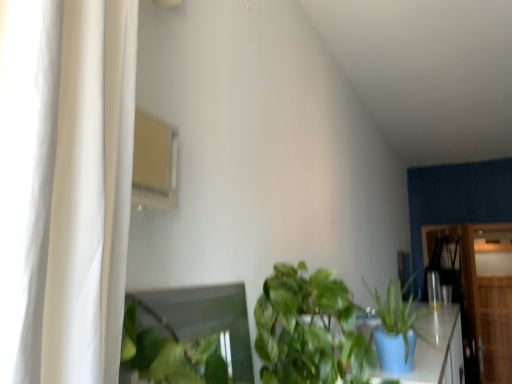
Locate an element on the screen. The image size is (512, 384). wooden dresser at right, which is the first dresser from right to left is located at coordinates (489, 297).

Measure the distance between point (337,309) and camera.

The depth of point (337,309) is 1.11 meters.

The width and height of the screenshot is (512, 384). What do you see at coordinates (309, 330) in the screenshot?
I see `green leafy plant at center, marked as the first houseplant in a left-to-right arrangement` at bounding box center [309, 330].

The height and width of the screenshot is (384, 512). What do you see at coordinates (482, 293) in the screenshot?
I see `wooden dresser at right, which is counted as the 1th dresser, starting from the left` at bounding box center [482, 293].

Where is `wooden dresser at right, which is the first dresser from right to left`? This screenshot has height=384, width=512. wooden dresser at right, which is the first dresser from right to left is located at coordinates (489, 297).

Between matte blue pot at lower right, the second houseplant when ordered from left to right, and green leafy plant at center, marked as the first houseplant in a left-to-right arrangement, which one appears on the left side from the viewer's perspective?

green leafy plant at center, marked as the first houseplant in a left-to-right arrangement.

Is the position of matte blue pot at lower right, the 1th houseplant from the right, more distant than that of green leafy plant at center, placed as the second houseplant when sorted from right to left?

Yes.

Considering the positions of point (408, 301) and point (332, 295), is point (408, 301) closer or farther from the camera than point (332, 295)?

Point (408, 301) is farther from the camera than point (332, 295).

The height and width of the screenshot is (384, 512). In order to click on dresser below the wooden dresser at right, the second dresser from the back (from a real-world perspective) in this screenshot , I will do `click(489, 297)`.

Could you tell me if wooden dresser at right, positioned as the 2th dresser in left-to-right order, is facing wooden dresser at right, which is counted as the 1th dresser, starting from the left?

Yes.

How many degrees apart are the facing directions of wooden dresser at right, which is the first dresser from right to left, and wooden dresser at right, the 1th dresser from the front?

There is a 7.76-degree angle between the facing directions of wooden dresser at right, which is the first dresser from right to left, and wooden dresser at right, the 1th dresser from the front.

From a real-world perspective, is wooden dresser at right, positioned as the 2th dresser in left-to-right order, above or below wooden dresser at right, which is counted as the 1th dresser, starting from the left?

From a real-world perspective, wooden dresser at right, positioned as the 2th dresser in left-to-right order, is physically below wooden dresser at right, which is counted as the 1th dresser, starting from the left.

Is wooden dresser at right, the 1th dresser from the front, oriented away from green leafy plant at center, marked as the first houseplant in a left-to-right arrangement?

wooden dresser at right, the 1th dresser from the front, is not turned away from green leafy plant at center, marked as the first houseplant in a left-to-right arrangement.

Between wooden dresser at right, which is counted as the 1th dresser, starting from the left, and green leafy plant at center, placed as the second houseplant when sorted from right to left, which one appears on the left side from the viewer's perspective?

green leafy plant at center, placed as the second houseplant when sorted from right to left, is more to the left.

Considering the sizes of wooden dresser at right, the 1th dresser from the front, and green leafy plant at center, placed as the second houseplant when sorted from right to left, in the image, is wooden dresser at right, the 1th dresser from the front, taller or shorter than green leafy plant at center, placed as the second houseplant when sorted from right to left,?

wooden dresser at right, the 1th dresser from the front, is taller than green leafy plant at center, placed as the second houseplant when sorted from right to left.

Is point (494, 254) positioned in front of point (343, 340)?

No, it is behind (343, 340).

From a real-world perspective, is wooden dresser at right, marked as the first dresser in a back-to-front arrangement, physically above green leafy plant at center, marked as the first houseplant in a left-to-right arrangement?

No, from a real-world perspective, wooden dresser at right, marked as the first dresser in a back-to-front arrangement, is not above green leafy plant at center, marked as the first houseplant in a left-to-right arrangement.

Could you tell me if wooden dresser at right, placed as the second dresser when sorted from front to back, is facing green leafy plant at center, placed as the second houseplant when sorted from right to left?

Yes, wooden dresser at right, placed as the second dresser when sorted from front to back, is oriented towards green leafy plant at center, placed as the second houseplant when sorted from right to left.

How much distance is there between wooden dresser at right, placed as the second dresser when sorted from front to back, and green leafy plant at center, placed as the second houseplant when sorted from right to left?

wooden dresser at right, placed as the second dresser when sorted from front to back, and green leafy plant at center, placed as the second houseplant when sorted from right to left, are 8.10 feet apart.

From the image's perspective, which is above, green leafy plant at center, placed as the second houseplant when sorted from right to left, or wooden dresser at right, marked as the first dresser in a back-to-front arrangement?

From the image's view, green leafy plant at center, placed as the second houseplant when sorted from right to left, is above.

Considering the relative sizes of green leafy plant at center, marked as the first houseplant in a left-to-right arrangement, and wooden dresser at right, marked as the first dresser in a back-to-front arrangement, in the image provided, is green leafy plant at center, marked as the first houseplant in a left-to-right arrangement, shorter than wooden dresser at right, marked as the first dresser in a back-to-front arrangement,?

Yes.

From a real-world perspective, is green leafy plant at center, placed as the second houseplant when sorted from right to left, positioned over wooden dresser at right, marked as the first dresser in a back-to-front arrangement, based on gravity?

Correct, in the physical world, green leafy plant at center, placed as the second houseplant when sorted from right to left, is higher than wooden dresser at right, marked as the first dresser in a back-to-front arrangement.

What's the angular difference between green leafy plant at center, marked as the first houseplant in a left-to-right arrangement, and wooden dresser at right, positioned as the 2th dresser in left-to-right order,'s facing directions?

The angle between the facing direction of green leafy plant at center, marked as the first houseplant in a left-to-right arrangement, and the facing direction of wooden dresser at right, positioned as the 2th dresser in left-to-right order, is 98.8 degrees.

Considering the relative sizes of green leafy plant at center, marked as the first houseplant in a left-to-right arrangement, and matte blue pot at lower right, the second houseplant when ordered from left to right, in the image provided, is green leafy plant at center, marked as the first houseplant in a left-to-right arrangement, smaller than matte blue pot at lower right, the second houseplant when ordered from left to right,?

Incorrect, green leafy plant at center, marked as the first houseplant in a left-to-right arrangement, is not smaller in size than matte blue pot at lower right, the second houseplant when ordered from left to right.

Looking at this image, is matte blue pot at lower right, the second houseplant when ordered from left to right, completely or partially inside green leafy plant at center, placed as the second houseplant when sorted from right to left?

Yes, matte blue pot at lower right, the second houseplant when ordered from left to right, can be found within green leafy plant at center, placed as the second houseplant when sorted from right to left.

From a real-world perspective, who is located lower, green leafy plant at center, placed as the second houseplant when sorted from right to left, or matte blue pot at lower right, the second houseplant when ordered from left to right?

matte blue pot at lower right, the second houseplant when ordered from left to right, is physically lower.

Could you tell me if green leafy plant at center, marked as the first houseplant in a left-to-right arrangement, is facing matte blue pot at lower right, the 1th houseplant from the right?

Yes, green leafy plant at center, marked as the first houseplant in a left-to-right arrangement, is facing matte blue pot at lower right, the 1th houseplant from the right.

Which object is further away from the camera, matte blue pot at lower right, the 1th houseplant from the right, or wooden dresser at right, positioned as the 2th dresser in left-to-right order?

wooden dresser at right, positioned as the 2th dresser in left-to-right order, is more distant.

From a real-world perspective, is matte blue pot at lower right, the second houseplant when ordered from left to right, positioned under wooden dresser at right, placed as the second dresser when sorted from front to back, based on gravity?

No, from a real-world perspective, matte blue pot at lower right, the second houseplant when ordered from left to right, is not under wooden dresser at right, placed as the second dresser when sorted from front to back.

Looking at this image, is matte blue pot at lower right, the second houseplant when ordered from left to right, bigger than wooden dresser at right, marked as the first dresser in a back-to-front arrangement?

Actually, matte blue pot at lower right, the second houseplant when ordered from left to right, might be smaller than wooden dresser at right, marked as the first dresser in a back-to-front arrangement.

From the image's perspective, would you say matte blue pot at lower right, the 1th houseplant from the right, is positioned over wooden dresser at right, placed as the second dresser when sorted from front to back?

Yes, from the image's perspective, matte blue pot at lower right, the 1th houseplant from the right, is over wooden dresser at right, placed as the second dresser when sorted from front to back.

You are a GUI agent. You are given a task and a screenshot of the screen. Output one action in this format:
    pyautogui.click(x=<x>, y=<y>)
    Task: Click on the houseplant lying below the green leafy plant at center, placed as the second houseplant when sorted from right to left (from the image's perspective)
    
    Given the screenshot: What is the action you would take?
    pyautogui.click(x=395, y=328)

You are a GUI agent. You are given a task and a screenshot of the screen. Output one action in this format:
    pyautogui.click(x=<x>, y=<y>)
    Task: Click on the dresser lying on the left of wooden dresser at right, marked as the first dresser in a back-to-front arrangement
    
    Given the screenshot: What is the action you would take?
    pyautogui.click(x=482, y=293)

From the image, which object appears to be nearer to wooden dresser at right, marked as the first dresser in a back-to-front arrangement, green leafy plant at center, placed as the second houseplant when sorted from right to left, or wooden dresser at right, the second dresser from the back?

wooden dresser at right, the second dresser from the back, is positioned closer to the anchor wooden dresser at right, marked as the first dresser in a back-to-front arrangement.

Estimate the real-world distances between objects in this image. Which object is further from matte blue pot at lower right, the 1th houseplant from the right, green leafy plant at center, marked as the first houseplant in a left-to-right arrangement, or wooden dresser at right, marked as the first dresser in a back-to-front arrangement?

Among the two, wooden dresser at right, marked as the first dresser in a back-to-front arrangement, is located further to matte blue pot at lower right, the 1th houseplant from the right.

Which object lies nearer to the anchor point wooden dresser at right, positioned as the 2th dresser in left-to-right order, matte blue pot at lower right, the second houseplant when ordered from left to right, or wooden dresser at right, which ranks as the second dresser in right-to-left order?

The object closer to wooden dresser at right, positioned as the 2th dresser in left-to-right order, is wooden dresser at right, which ranks as the second dresser in right-to-left order.

Based on their spatial positions, is matte blue pot at lower right, the 1th houseplant from the right, or wooden dresser at right, positioned as the 2th dresser in left-to-right order, further from wooden dresser at right, which ranks as the second dresser in right-to-left order?

matte blue pot at lower right, the 1th houseplant from the right, is positioned further to the anchor wooden dresser at right, which ranks as the second dresser in right-to-left order.

Considering their positions, is wooden dresser at right, placed as the second dresser when sorted from front to back, positioned closer to matte blue pot at lower right, the second houseplant when ordered from left to right, than wooden dresser at right, the 1th dresser from the front?

The object closer to matte blue pot at lower right, the second houseplant when ordered from left to right, is wooden dresser at right, placed as the second dresser when sorted from front to back.

From the image, which object appears to be farther from wooden dresser at right, positioned as the 2th dresser in left-to-right order, wooden dresser at right, the second dresser from the back, or matte blue pot at lower right, the second houseplant when ordered from left to right?

matte blue pot at lower right, the second houseplant when ordered from left to right.

When comparing their distances from green leafy plant at center, marked as the first houseplant in a left-to-right arrangement, does wooden dresser at right, which is counted as the 1th dresser, starting from the left, or matte blue pot at lower right, the second houseplant when ordered from left to right, seem further?

The object further to green leafy plant at center, marked as the first houseplant in a left-to-right arrangement, is wooden dresser at right, which is counted as the 1th dresser, starting from the left.

Looking at the image, which one is located further to green leafy plant at center, placed as the second houseplant when sorted from right to left, wooden dresser at right, placed as the second dresser when sorted from front to back, or matte blue pot at lower right, the second houseplant when ordered from left to right?

wooden dresser at right, placed as the second dresser when sorted from front to back, is positioned further to the anchor green leafy plant at center, placed as the second houseplant when sorted from right to left.

Locate an element on the screen. dresser between green leafy plant at center, placed as the second houseplant when sorted from right to left, and wooden dresser at right, positioned as the 2th dresser in left-to-right order, in the front-back direction is located at coordinates (482, 293).

At what (x,y) coordinates should I click in order to perform the action: click on dresser positioned between matte blue pot at lower right, the second houseplant when ordered from left to right, and wooden dresser at right, which is the first dresser from right to left, from near to far. Please return your answer as a coordinate pair (x, y). The width and height of the screenshot is (512, 384). Looking at the image, I should click on (482, 293).

Image resolution: width=512 pixels, height=384 pixels. In order to click on houseplant between green leafy plant at center, marked as the first houseplant in a left-to-right arrangement, and wooden dresser at right, placed as the second dresser when sorted from front to back, along the z-axis in this screenshot , I will do `click(395, 328)`.

Where is `houseplant positioned between green leafy plant at center, placed as the second houseplant when sorted from right to left, and wooden dresser at right, the 1th dresser from the front, from near to far`? The height and width of the screenshot is (384, 512). houseplant positioned between green leafy plant at center, placed as the second houseplant when sorted from right to left, and wooden dresser at right, the 1th dresser from the front, from near to far is located at coordinates (395, 328).